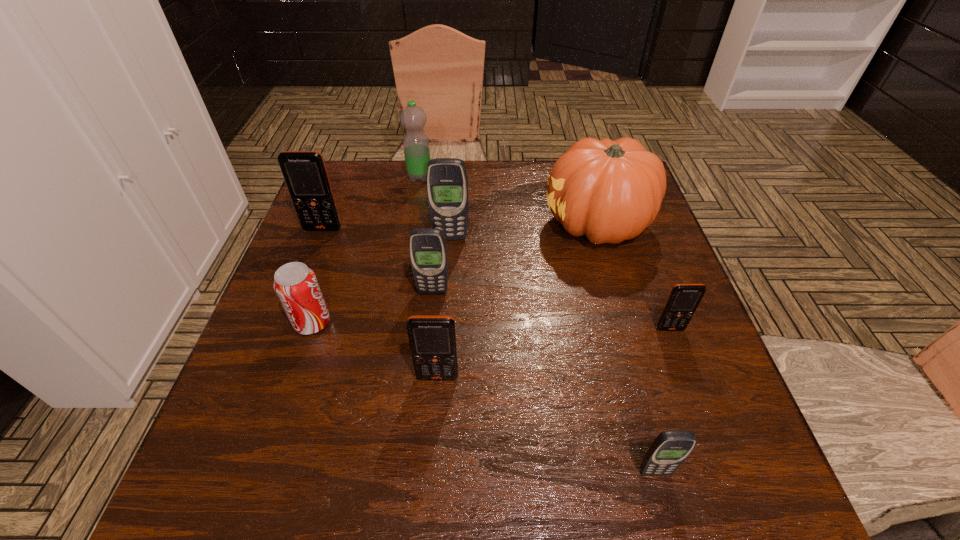
Locate an element on the screen. The width and height of the screenshot is (960, 540). vacant space located 0.200m on the screen of the leftmost cellular telephone is located at coordinates (300, 289).

In order to click on vacant area situated 0.400m on the screen of the biggest gray cellular telephone in this screenshot , I will do `click(441, 379)`.

This screenshot has height=540, width=960. Identify the location of blank space located on the screen of the second farthest gray cellular telephone. (427, 347).

Find the location of `vacant area situated 0.220m on the screen of the nearest orange cellular telephone`. vacant area situated 0.220m on the screen of the nearest orange cellular telephone is located at coordinates (428, 507).

Find the location of a particular element. The height and width of the screenshot is (540, 960). vacant area situated 0.180m on the logo side of the soda can is located at coordinates (416, 322).

At what (x,y) coordinates should I click in order to perform the action: click on blank space located 0.140m on the screen of the second nearest orange cellular telephone. Please return your answer as a coordinate pair (x, y). This screenshot has width=960, height=540. Looking at the image, I should click on (694, 393).

Where is `water bottle that is at the far edge`? This screenshot has height=540, width=960. water bottle that is at the far edge is located at coordinates (413, 118).

Where is `pumpkin situated at the far edge`? The image size is (960, 540). pumpkin situated at the far edge is located at coordinates (610, 191).

This screenshot has width=960, height=540. Find the location of `object that is positioned at the near edge`. object that is positioned at the near edge is located at coordinates tap(668, 451).

Where is `cellular telephone at the left edge`? The height and width of the screenshot is (540, 960). cellular telephone at the left edge is located at coordinates (305, 174).